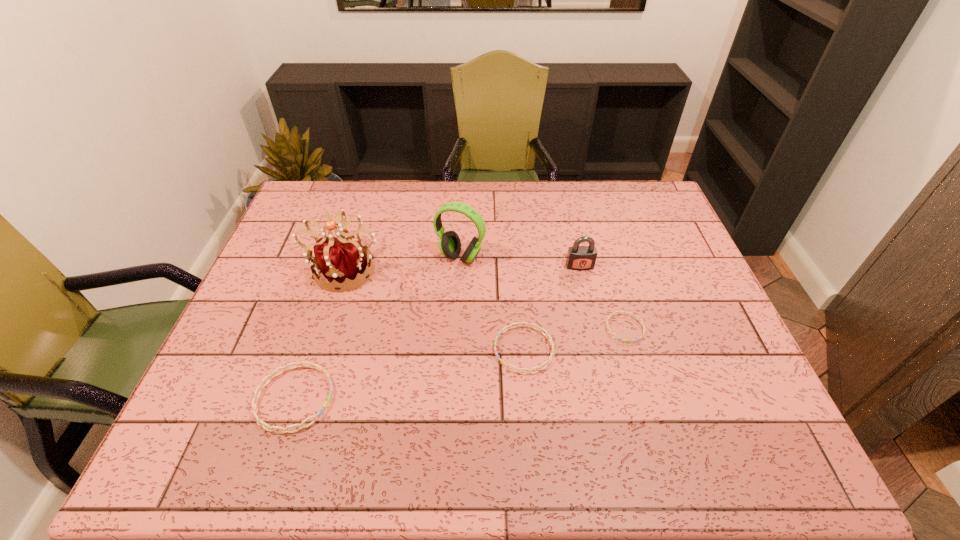
I want to click on the leftmost bracelet, so click(254, 401).

Where is `the fourth object from left to right`? This screenshot has width=960, height=540. the fourth object from left to right is located at coordinates (547, 335).

At what (x,y) coordinates should I click in order to perform the action: click on the second bracelet from left to right. Please return your answer as a coordinate pair (x, y). Looking at the image, I should click on (547, 335).

Locate an element on the screen. This screenshot has width=960, height=540. the shortest bracelet is located at coordinates (623, 340).

Identify the location of the rightmost bracelet. The height and width of the screenshot is (540, 960). (623, 340).

You are a GUI agent. You are given a task and a screenshot of the screen. Output one action in this format:
    pyautogui.click(x=<x>, y=<y>)
    Task: Click on the padlock
    
    Given the screenshot: What is the action you would take?
    pyautogui.click(x=580, y=258)

Find the location of a particular element. The height and width of the screenshot is (540, 960). tiara is located at coordinates point(340,260).

Locate an element on the screen. This screenshot has width=960, height=540. headset is located at coordinates (449, 243).

At what (x,y) coordinates should I click in order to perform the action: click on vacant space located on the surface of the leftmost bracelet showing star-shaped elements. Please return your answer as a coordinate pair (x, y). This screenshot has height=540, width=960. Looking at the image, I should click on (399, 399).

This screenshot has height=540, width=960. I want to click on vacant space located on the surface of the fourth object from left to right showing star-shaped elements, so click(357, 349).